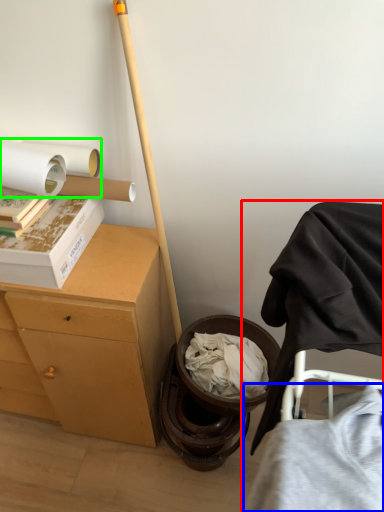
Question: Which is farther away from furniture (highlighted by a red box)? clothing (highlighted by a blue box) or toilet paper (highlighted by a green box)?

Choices:
 (A) clothing
 (B) toilet paper

Answer: (B)